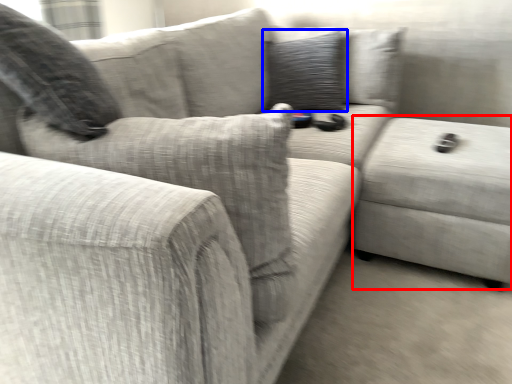
Question: Which object is further to the camera taking this photo, gray (highlighted by a red box) or pillow (highlighted by a blue box)?

Choices:
 (A) gray
 (B) pillow

Answer: (B)